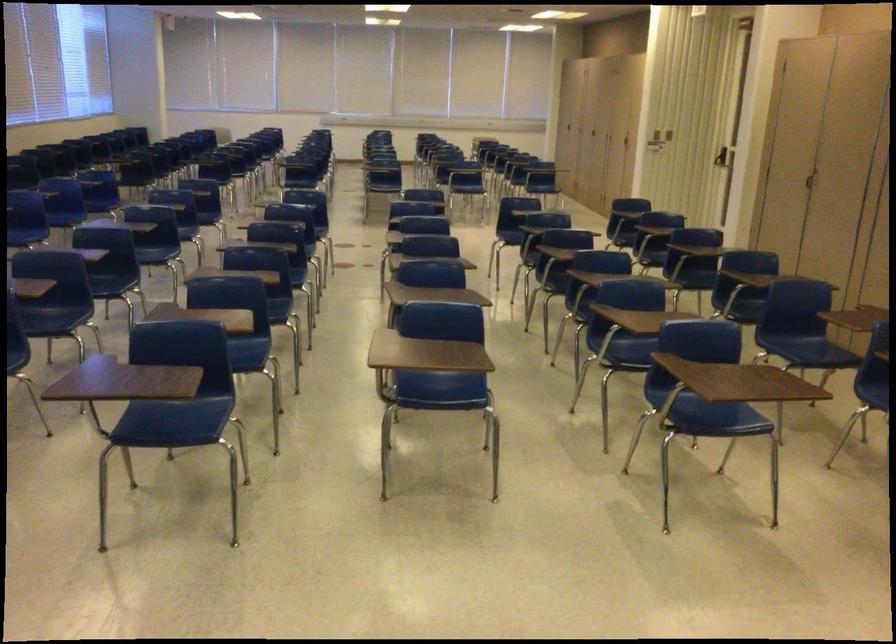
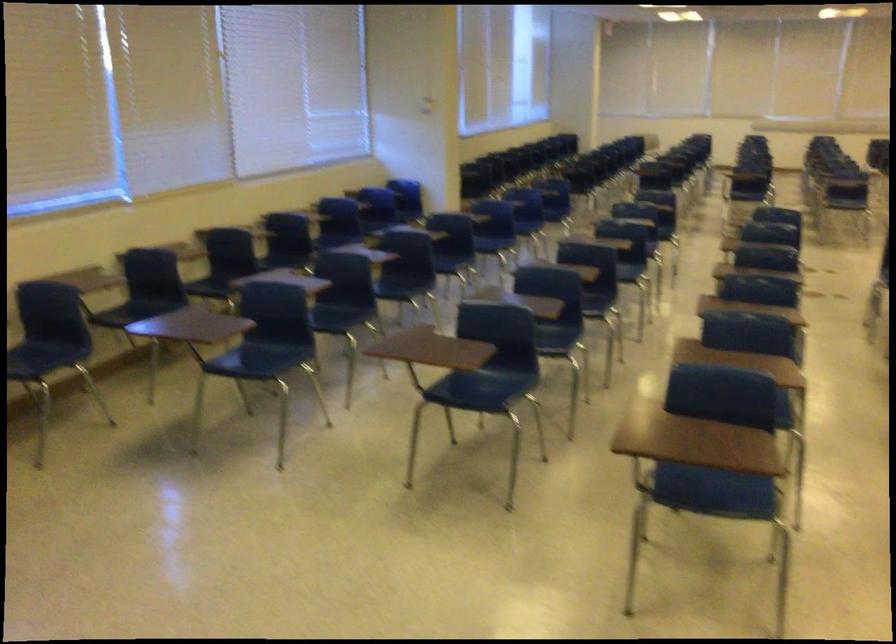
Question: Which direction would the cameraman need to move to produce the second image? Reply with the corresponding letter.

Choices:
 (A) Left
 (B) Right
 (C) Forward
 (D) Backward

Answer: (A)